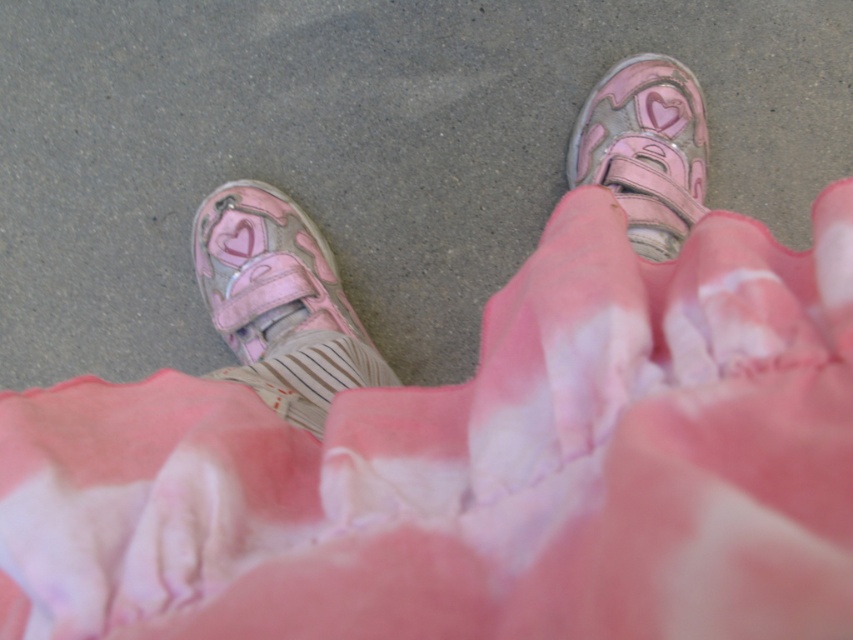
How far apart are pink matte shoe at lower left and shiny pink velcro shoe at center?

The distance of pink matte shoe at lower left from shiny pink velcro shoe at center is 17.29 inches.

Is point (256, 300) behind point (621, 132)?

No, (256, 300) is closer to viewer.

Is point (289, 209) positioned before point (679, 116)?

No.

Identify the location of pink matte shoe at lower left. (279, 301).